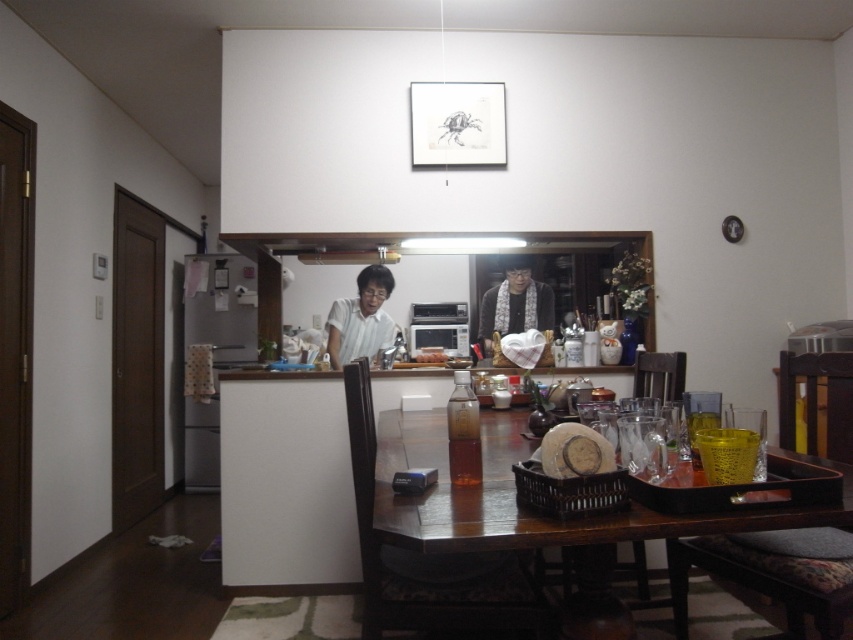
You are standing in the kitchen and see the wooden table at center and the white matte shirt at center. Which object is positioned to the right of the other?

The wooden table at center is to the right of the white matte shirt at center.

You are a delivery person who needs to place a package on the table without moving any items. The package is 5 feet long. Can you fit it between the wooden cushioned chair at right and the white matte shirt at center?

The wooden cushioned chair at right is 6.01 feet away from the white matte shirt at center, so yes, the package can be placed between them since the distance is slightly more than the package length.